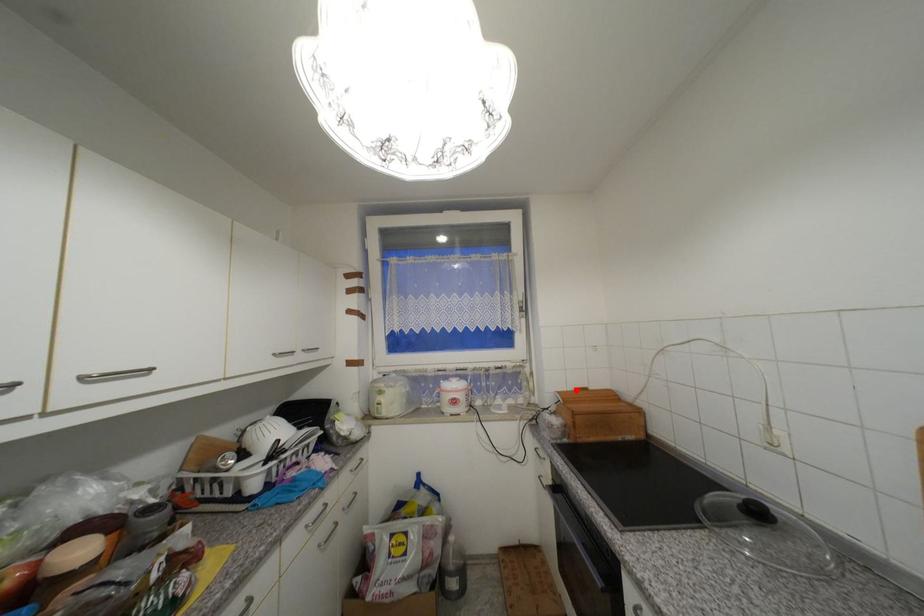
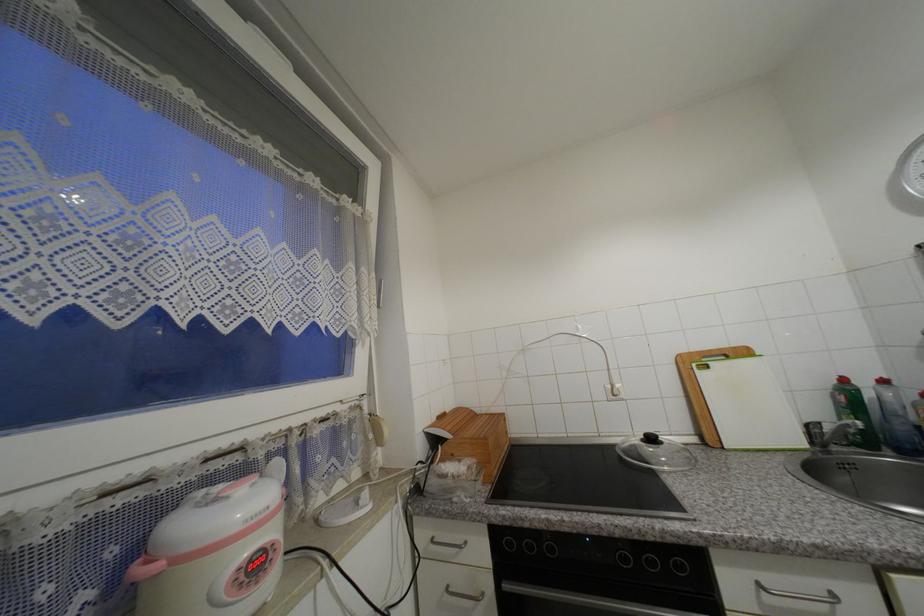
Question: I am providing you with two images of the same scene from different viewpoints. A red point is marked on the first image. Can you still see the location of the red point in image 2?

Choices:
 (A) Yes
 (B) No

Answer: (A)